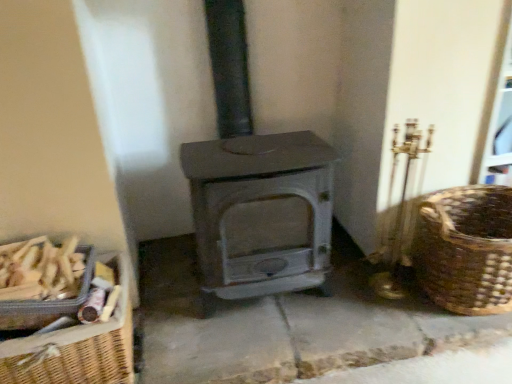
Find the location of `free space that is to the left of brown woven basket at right, placed as the 1th basket when sorted from right to left`. free space that is to the left of brown woven basket at right, placed as the 1th basket when sorted from right to left is located at coordinates (361, 298).